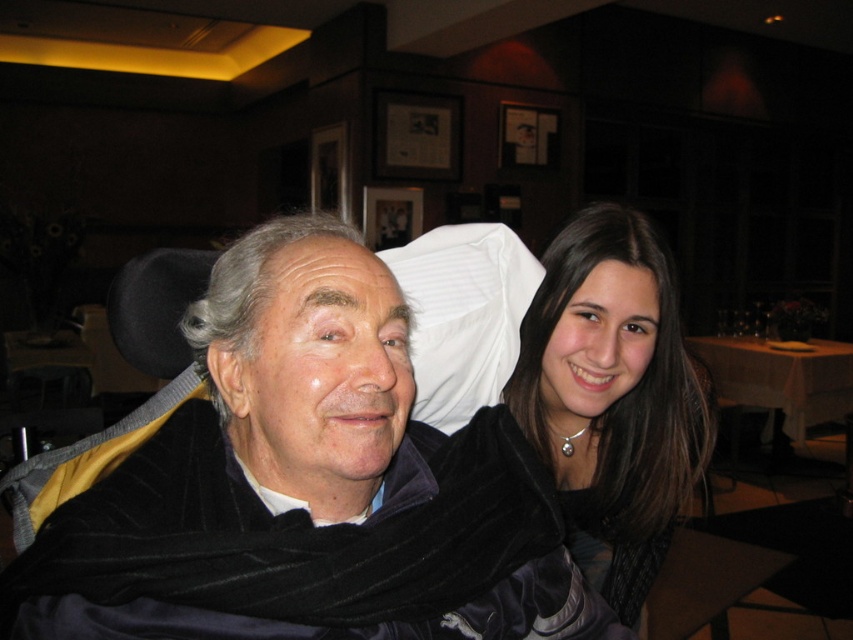
Question: Which point is closer to the camera taking this photo?

Choices:
 (A) (x=813, y=369)
 (B) (x=421, y=440)
 (C) (x=631, y=356)

Answer: (B)

Question: Which of the following is the farthest from the observer?

Choices:
 (A) (677, 317)
 (B) (825, 397)

Answer: (B)

Question: Does velvet black jacket at center appear on the right side of white tablecloth at right?

Choices:
 (A) yes
 (B) no

Answer: (B)

Question: Is velvet black jacket at center thinner than velvet black jacket at upper right?

Choices:
 (A) yes
 (B) no

Answer: (B)

Question: Is velvet black jacket at center positioned in front of white tablecloth at right?

Choices:
 (A) yes
 (B) no

Answer: (A)

Question: Which object appears closest to the camera in this image?

Choices:
 (A) velvet black jacket at upper right
 (B) white tablecloth at right
 (C) velvet black jacket at center

Answer: (C)